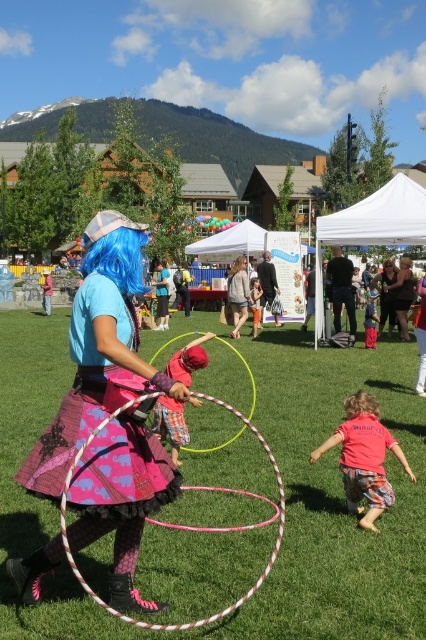
Does point (324, 545) come in front of point (94, 392)?

That is False.

Which is behind, point (359, 625) or point (109, 348)?

The point (359, 625) is more distant.

Which is in front, point (183, 480) or point (104, 316)?

Point (104, 316) is more forward.

This screenshot has width=426, height=640. I want to click on green grass at center, so click(284, 484).

Which is more to the right, green grass at center or matte black dress at center?

matte black dress at center

Is green grass at center to the left of matte black dress at center from the viewer's perspective?

Correct, you'll find green grass at center to the left of matte black dress at center.

Does point (0, 368) lie behind point (388, 285)?

No, it is not.

At what (x,y) coordinates should I click in order to perform the action: click on green grass at center. Please return your answer as a coordinate pair (x, y). Image resolution: width=426 pixels, height=640 pixels. Looking at the image, I should click on (284, 484).

How much distance is there between green grass at center and pink cotton shirt at lower right?

The distance of green grass at center from pink cotton shirt at lower right is 1.85 meters.

Can you confirm if green grass at center is positioned above pink cotton shirt at lower right?

Yes.

You are a GUI agent. You are given a task and a screenshot of the screen. Output one action in this format:
    pyautogui.click(x=<x>, y=<y>)
    Task: Click on the green grass at center
    
    Given the screenshot: What is the action you would take?
    pyautogui.click(x=284, y=484)